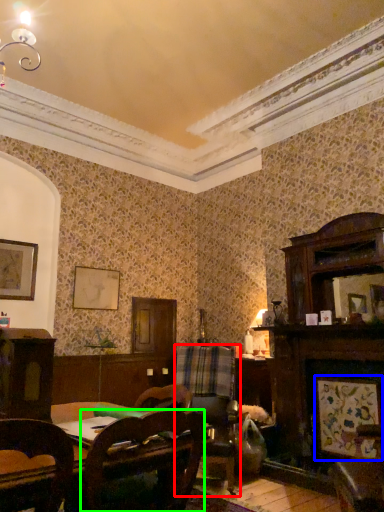
Question: Which object is positioned farthest from swivel chair (highlighted by a red box)? Select from picture frame (highlighted by a blue box) and chair (highlighted by a green box).

Choices:
 (A) picture frame
 (B) chair

Answer: (B)